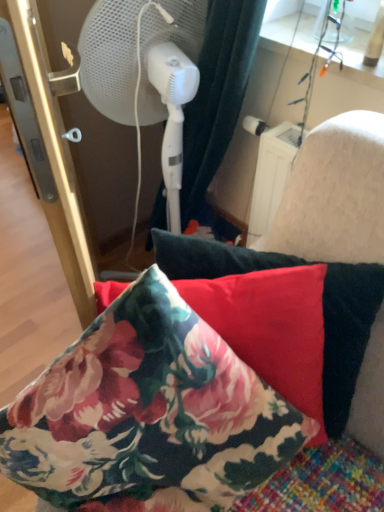
Question: Is floral fabric pillow at center wider or thinner than white plastic mechanical fan at left?

Choices:
 (A) wide
 (B) thin

Answer: (B)

Question: Would you say floral fabric pillow at center is inside or outside white plastic mechanical fan at left?

Choices:
 (A) outside
 (B) inside

Answer: (A)

Question: Is floral fabric pillow at center to the left or to the right of white plastic mechanical fan at left in the image?

Choices:
 (A) right
 (B) left

Answer: (A)

Question: Considering the positions of white plastic mechanical fan at left and floral fabric pillow at center in the image, is white plastic mechanical fan at left taller or shorter than floral fabric pillow at center?

Choices:
 (A) tall
 (B) short

Answer: (A)

Question: From the image's perspective, is white plastic mechanical fan at left positioned above or below floral fabric pillow at center?

Choices:
 (A) below
 (B) above

Answer: (B)

Question: From a real-world perspective, relative to floral fabric pillow at center, is white plastic mechanical fan at left vertically above or below?

Choices:
 (A) below
 (B) above

Answer: (B)

Question: Considering the relative positions of white plastic mechanical fan at left and floral fabric pillow at center in the image provided, is white plastic mechanical fan at left to the left or to the right of floral fabric pillow at center?

Choices:
 (A) left
 (B) right

Answer: (A)